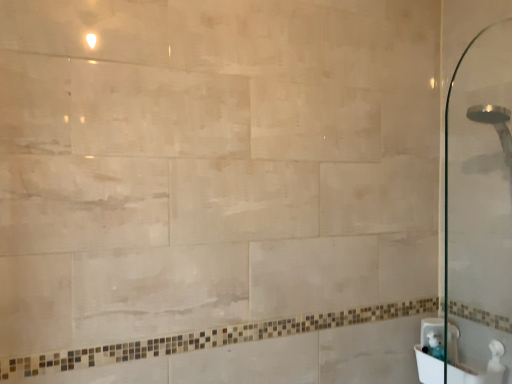
Question: From the image's perspective, is white glossy sink at lower right, positioned as the 2th sink in back-to-front order, below white glossy sink at lower right, which is the second sink from front to back?

Choices:
 (A) yes
 (B) no

Answer: (A)

Question: Is white glossy sink at lower right, positioned as the 2th sink in back-to-front order, smaller than white glossy sink at lower right, which is the second sink from front to back?

Choices:
 (A) yes
 (B) no

Answer: (B)

Question: Is white glossy sink at lower right, positioned as the 2th sink in back-to-front order, to the right of white glossy sink at lower right, placed as the first sink when sorted from back to front, from the viewer's perspective?

Choices:
 (A) yes
 (B) no

Answer: (A)

Question: From the image's perspective, does white glossy sink at lower right, the 1th sink viewed from the front, appear higher than white glossy sink at lower right, which is the second sink from front to back?

Choices:
 (A) yes
 (B) no

Answer: (B)

Question: Does white glossy sink at lower right, positioned as the 2th sink in back-to-front order, lie behind white glossy sink at lower right, placed as the first sink when sorted from back to front?

Choices:
 (A) yes
 (B) no

Answer: (B)

Question: Can you confirm if white glossy sink at lower right, positioned as the 2th sink in back-to-front order, is positioned to the left of white glossy sink at lower right, which is the second sink from front to back?

Choices:
 (A) no
 (B) yes

Answer: (A)

Question: Would you say white glossy sink at lower right, which is the second sink from front to back, is outside white glossy sink at lower right, positioned as the 2th sink in back-to-front order?

Choices:
 (A) yes
 (B) no

Answer: (B)

Question: Considering the relative sizes of white glossy sink at lower right, placed as the first sink when sorted from back to front, and white glossy sink at lower right, the 1th sink viewed from the front, in the image provided, is white glossy sink at lower right, placed as the first sink when sorted from back to front, taller than white glossy sink at lower right, the 1th sink viewed from the front,?

Choices:
 (A) yes
 (B) no

Answer: (A)

Question: From the image's perspective, is white glossy sink at lower right, placed as the first sink when sorted from back to front, located beneath white glossy sink at lower right, the 1th sink viewed from the front?

Choices:
 (A) no
 (B) yes

Answer: (A)

Question: Does white glossy sink at lower right, placed as the first sink when sorted from back to front, appear on the right side of white glossy sink at lower right, positioned as the 2th sink in back-to-front order?

Choices:
 (A) yes
 (B) no

Answer: (B)

Question: Is white glossy sink at lower right, which is the second sink from front to back, surrounding white glossy sink at lower right, the 1th sink viewed from the front?

Choices:
 (A) yes
 (B) no

Answer: (B)

Question: From a real-world perspective, is white glossy sink at lower right, which is the second sink from front to back, physically below white glossy sink at lower right, positioned as the 2th sink in back-to-front order?

Choices:
 (A) yes
 (B) no

Answer: (B)

Question: In the image, is white glossy sink at lower right, positioned as the 2th sink in back-to-front order, on the left side or the right side of white glossy sink at lower right, placed as the first sink when sorted from back to front?

Choices:
 (A) right
 (B) left

Answer: (A)